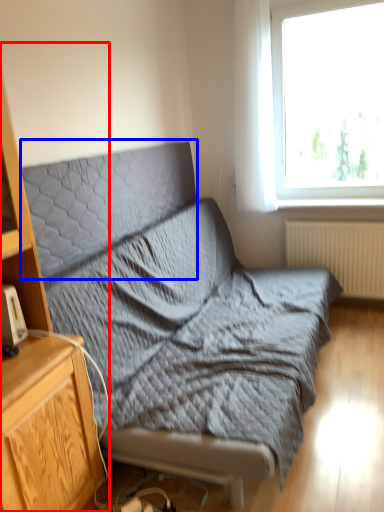
Question: Which object appears closest to the camera in this image, cabinetry (highlighted by a red box) or pillow (highlighted by a blue box)?

Choices:
 (A) cabinetry
 (B) pillow

Answer: (A)